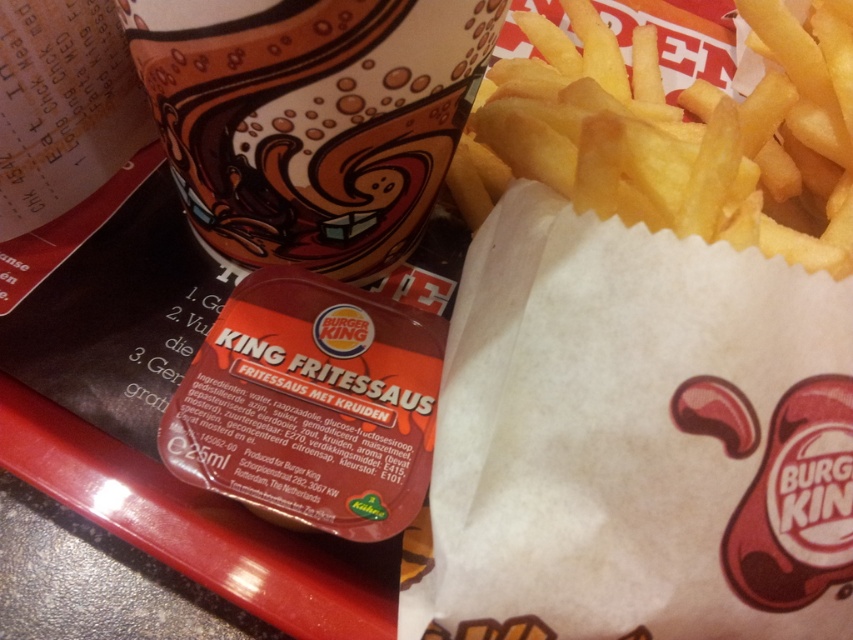
Between point (396, 150) and point (540, 144), which one is positioned in front?

Point (396, 150)

Between matte ceramic cup at upper center and golden crispy french fries at upper right, which one is positioned higher?

golden crispy french fries at upper right is higher up.

Who is more distant from viewer, (238, 214) or (819, 42)?

Point (819, 42)

At what (x,y) coordinates should I click in order to perform the action: click on matte ceramic cup at upper center. Please return your answer as a coordinate pair (x, y). The height and width of the screenshot is (640, 853). Looking at the image, I should click on (310, 120).